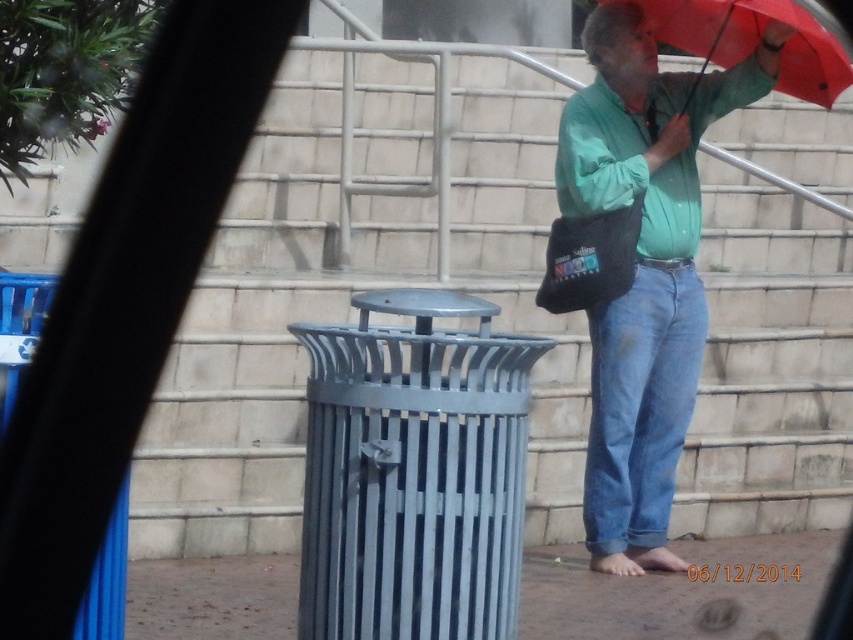
Who is positioned more to the right, green matte shirt at upper right or red matte umbrella at upper right?

red matte umbrella at upper right

Which of these two, green matte shirt at upper right or red matte umbrella at upper right, stands taller?

green matte shirt at upper right is taller.

Who is more forward, (668, 214) or (817, 83)?

Point (668, 214) is in front.

Where is `green matte shirt at upper right`? The width and height of the screenshot is (853, 640). green matte shirt at upper right is located at coordinates (643, 269).

Is gray concrete stairs at center taller than green matte shirt at upper right?

Correct, gray concrete stairs at center is much taller as green matte shirt at upper right.

At what (x,y) coordinates should I click in order to perform the action: click on gray concrete stairs at center. Please return your answer as a coordinate pair (x, y). Looking at the image, I should click on (360, 276).

Can you confirm if gray concrete stairs at center is wider than red matte umbrella at upper right?

Yes.

From the picture: Between gray concrete stairs at center and red matte umbrella at upper right, which one has less height?

Standing shorter between the two is red matte umbrella at upper right.

Describe the element at coordinates (360, 276) in the screenshot. I see `gray concrete stairs at center` at that location.

At what (x,y) coordinates should I click in order to perform the action: click on gray concrete stairs at center. Please return your answer as a coordinate pair (x, y). The width and height of the screenshot is (853, 640). Looking at the image, I should click on (360, 276).